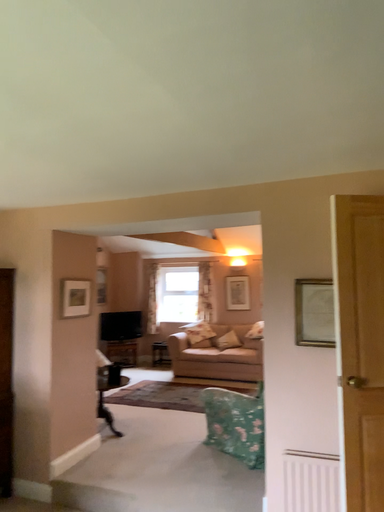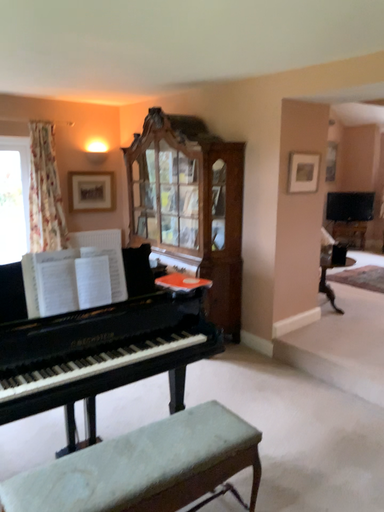
Question: How did the camera likely rotate when shooting the video?

Choices:
 (A) rotated right
 (B) rotated left

Answer: (B)